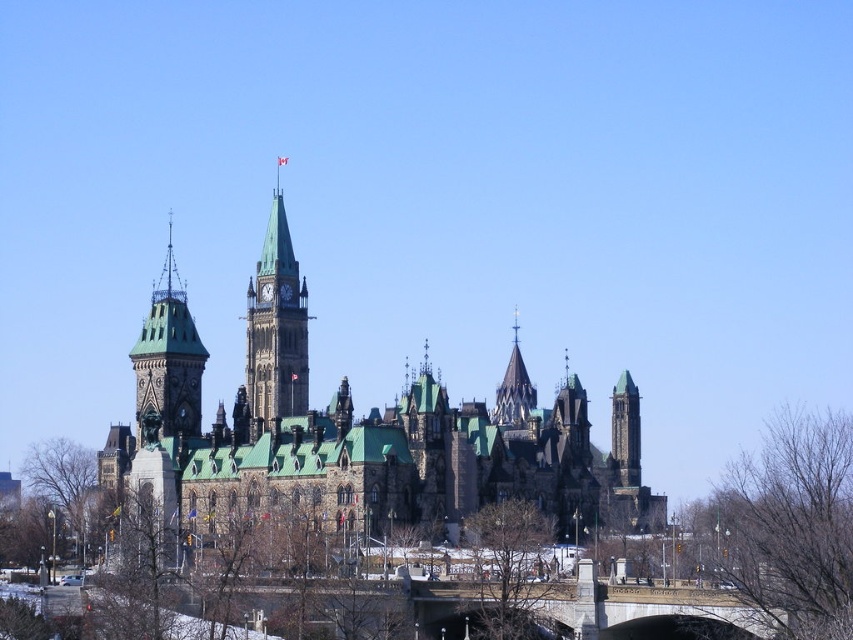
You are standing in front of the grand Gothic Revival building and notice two points marked on the structure. The first point is at coordinates point (270, 506) and the second is at point (175, 426). Which of these two points is physically closer to your current position?

Point (270, 506) is closer to the camera than point (175, 426), so the first point is physically closer to your current position.

You are an architect planning to add a new structure between the dark gray stone castle at center and the polished stone spire at center. Which existing structure should the new structure be wider than to maintain proportion?

The new structure should be wider than the polished stone spire at center because the dark gray stone castle at center is already wider, so maintaining proportion would require the new structure to not exceed the castle but surpass the spire.

You are standing in front of the grand architectural structure. You want to take a photo that includes both the green stone clock tower at center and the dark gray stone tower at center right. Which tower should you position closer to the camera to ensure both are in frame?

You should position the green stone clock tower at center closer to the camera since it is already closer to the viewer than the dark gray stone tower at center right, allowing both to be captured in the frame.